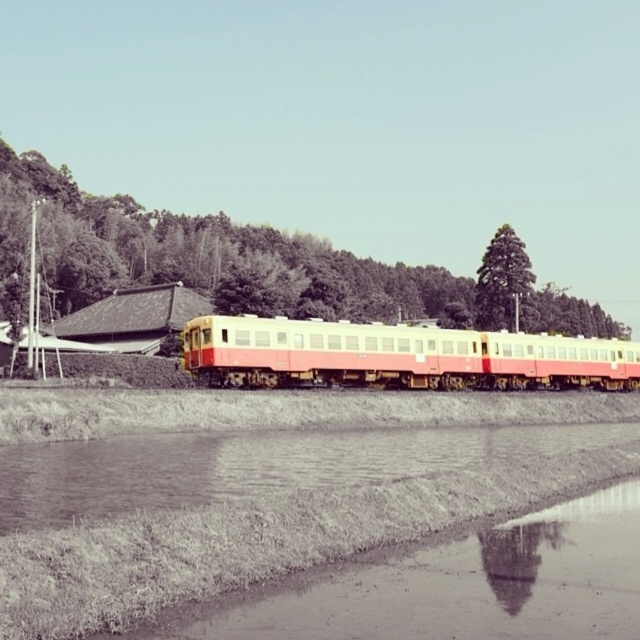
Based on the photo, does green leafy tree at center appear over matte pink and cream passenger train at center?

Indeed, green leafy tree at center is positioned over matte pink and cream passenger train at center.

Does green leafy tree at center appear on the right side of matte pink and cream passenger train at center?

Indeed, green leafy tree at center is positioned on the right side of matte pink and cream passenger train at center.

Locate an element on the screen. This screenshot has height=640, width=640. green leafy tree at center is located at coordinates (200, 257).

I want to click on green leafy tree at center, so click(200, 257).

Which is more to the left, green leafy tree at center or green leafy tree at upper center?

green leafy tree at center

Is the position of green leafy tree at center less distant than that of green leafy tree at upper center?

Yes, green leafy tree at center is closer to the viewer.

Which is in front, point (387, 316) or point (481, 278)?

Point (481, 278) is more forward.

Where is `green leafy tree at center`? This screenshot has width=640, height=640. green leafy tree at center is located at coordinates (200, 257).

Who is more forward, (550, 348) or (496, 298)?

Positioned in front is point (550, 348).

From the picture: Does matte pink and cream passenger train at center come behind green leafy tree at upper center?

No, it is not.

Locate an element on the screen. The width and height of the screenshot is (640, 640). matte pink and cream passenger train at center is located at coordinates (397, 355).